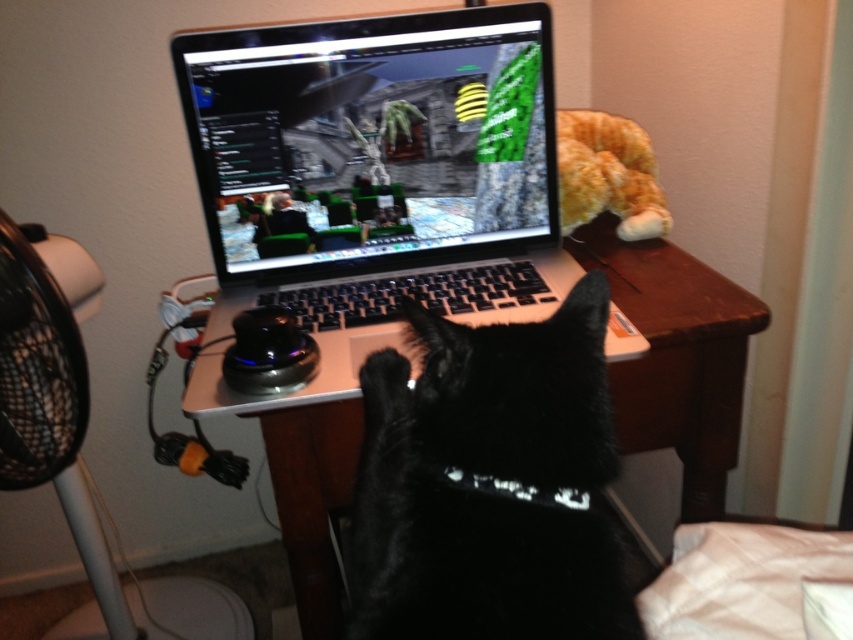
You are a photographer standing in front of the white wood computer desk at center. You want to take a photo of the black fur cat at center without the desk blocking the view. Is the cat positioned in a way that allows you to capture it clearly without the desk obstructing the shot?

The black fur cat at center is closer to the viewer than the white wood computer desk at center, so yes, the cat can be captured clearly without the desk blocking the view since it is in front of the desk.

You are organizing the desk and need to move the black plastic fan at left closer to the edge. Since the black fur cat at center is sitting on the desk, will moving the fan interfere with the cat?

The black fur cat at center is located above the black plastic fan at left, meaning the cat is sitting on top of the fan. Moving the fan would therefore disturb the cat, so it is advisable to first gently move the cat to a safe spot before adjusting the fan.

You are a visitor in the room and want to pet the black fur cat at center. To reach it, you need to walk around the orange plush at upper right. Is the cat closer to you than the plush?

Yes, the black fur cat at center is closer to the viewer than the orange plush at upper right, so you can reach the cat without needing to go around the plush.